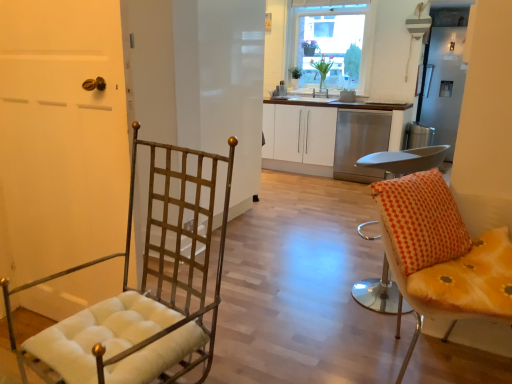
Question: From the image's perspective, is clear glass window at upper center above or below metallic grid screen door at center, the 2th screen door in the right-to-left sequence?

Choices:
 (A) above
 (B) below

Answer: (A)

Question: In terms of width, does clear glass window at upper center look wider or thinner when compared to metallic grid screen door at center, the first screen door viewed from the left?

Choices:
 (A) wide
 (B) thin

Answer: (B)

Question: Based on their relative distances, which object is farther from the yellow fabric cushion at right, marked as the 3th chair in a left-to-right arrangement?

Choices:
 (A) green leafy plant at upper center, the first houseplant positioned from the left
 (B) satin silver refrigerator at upper right, the second screen door from the left
 (C) white matte cabinet at center
 (D) clear glass window at upper center
 (E) green leafy plant at upper center, the 1th houseplant in the right-to-left sequence

Answer: (B)

Question: Which is farther from the yellow fabric cushion at right, marked as the 3th chair in a left-to-right arrangement?

Choices:
 (A) metallic grid screen door at center, the first screen door viewed from the left
 (B) metallic gold chair at left, acting as the 1th chair starting from the left
 (C) white matte cabinet at center
 (D) matte gold door at left
 (E) clear glass window at upper center

Answer: (E)